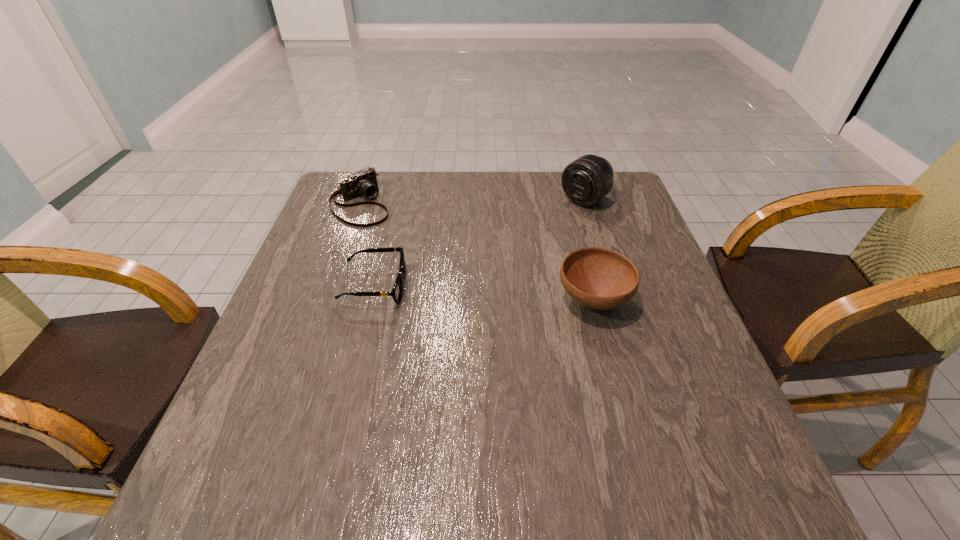
Where is `free space located on the front-facing side of the telephoto lens`? The height and width of the screenshot is (540, 960). free space located on the front-facing side of the telephoto lens is located at coordinates (482, 276).

The width and height of the screenshot is (960, 540). I want to click on free space located on the front-facing side of the telephoto lens, so click(x=479, y=278).

Identify the location of camera that is at the far edge. Image resolution: width=960 pixels, height=540 pixels. (363, 183).

Find the location of a particular element. This screenshot has height=540, width=960. telephoto lens situated at the far edge is located at coordinates (588, 179).

You are a GUI agent. You are given a task and a screenshot of the screen. Output one action in this format:
    pyautogui.click(x=<x>, y=<y>)
    Task: Click on the sunglasses that is at the left edge
    The width and height of the screenshot is (960, 540).
    Given the screenshot: What is the action you would take?
    pyautogui.click(x=397, y=290)

At what (x,y) coordinates should I click in order to perform the action: click on camera at the left edge. Please return your answer as a coordinate pair (x, y). Looking at the image, I should click on (363, 183).

Locate an element on the screen. bowl that is at the right edge is located at coordinates (598, 278).

At what (x,y) coordinates should I click in order to perform the action: click on telephoto lens situated at the right edge. Please return your answer as a coordinate pair (x, y). Looking at the image, I should click on (588, 179).

Locate an element on the screen. The image size is (960, 540). object at the far left corner is located at coordinates (363, 183).

At what (x,y) coordinates should I click in order to perform the action: click on object located at the far right corner. Please return your answer as a coordinate pair (x, y). Looking at the image, I should click on (588, 179).